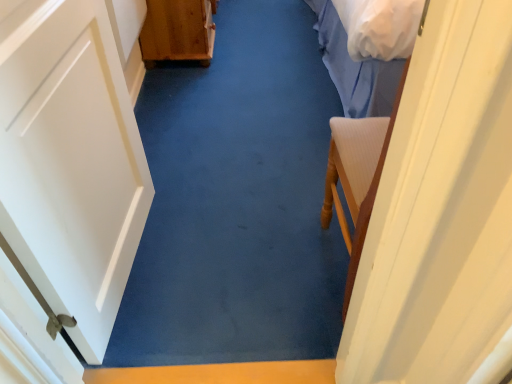
Where is `wooden chest at left`? wooden chest at left is located at coordinates (178, 31).

The width and height of the screenshot is (512, 384). What do you see at coordinates (178, 31) in the screenshot?
I see `wooden chest at left` at bounding box center [178, 31].

I want to click on wooden chest at left, so click(178, 31).